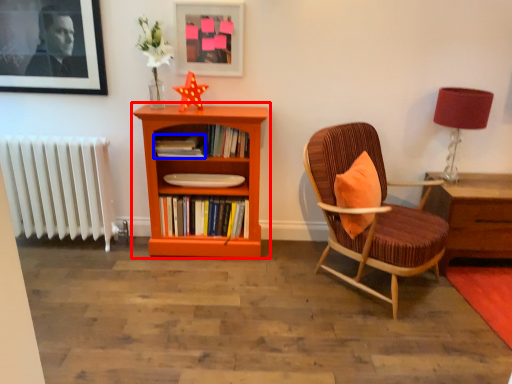
Question: Among these objects, which one is nearest to the camera, bookcase (highlighted by a red box) or book (highlighted by a blue box)?

Choices:
 (A) bookcase
 (B) book

Answer: (A)